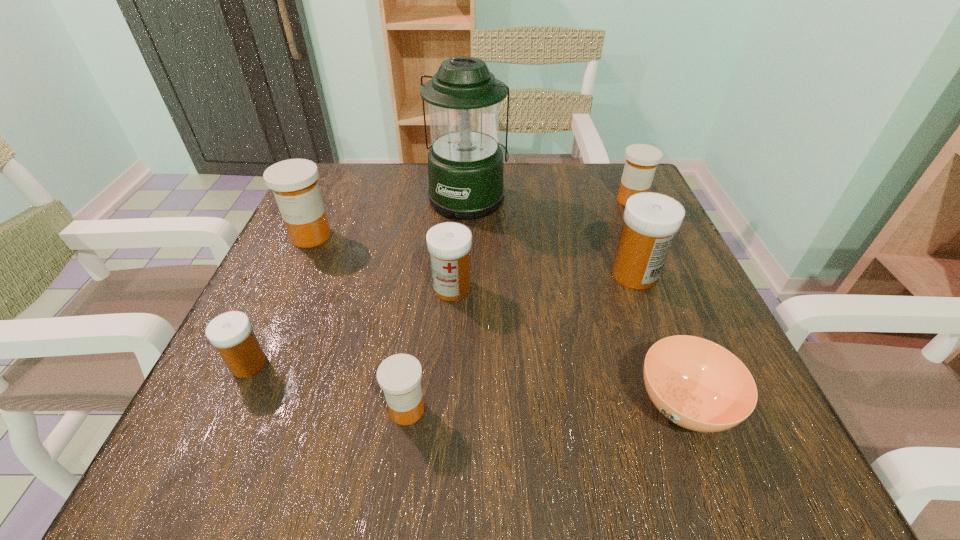
Locate an element on the screen. The height and width of the screenshot is (540, 960). vacant region at the far edge of the desktop is located at coordinates [527, 202].

I want to click on vacant space at the near edge of the desktop, so click(626, 424).

Where is `vacant space at the left edge of the desktop`? vacant space at the left edge of the desktop is located at coordinates (318, 295).

The image size is (960, 540). I want to click on free space at the right edge of the desktop, so click(x=670, y=281).

In the image, there is a desktop. At what (x,y) coordinates should I click in order to perform the action: click on free space at the far left corner. Please return your answer as a coordinate pair (x, y). Looking at the image, I should click on (365, 177).

Identify the location of blank space at the near right corner of the desktop. (742, 463).

Identify the location of free spot between the lantern and the biggest white medicine. The width and height of the screenshot is (960, 540). (551, 236).

This screenshot has width=960, height=540. What are the coordinates of `vacant point located between the second orange medicine from left to right and the peach soup bowl` in the screenshot? It's located at (545, 407).

Where is `vacant space in between the green lantern and the second farthest medicine`? The width and height of the screenshot is (960, 540). vacant space in between the green lantern and the second farthest medicine is located at coordinates (390, 217).

You are a GUI agent. You are given a task and a screenshot of the screen. Output one action in this format:
    pyautogui.click(x=<x>, y=<y>)
    Task: Click on the free spot between the third farthest object and the nearest medicine
    The image size is (960, 540).
    Given the screenshot: What is the action you would take?
    pyautogui.click(x=359, y=322)